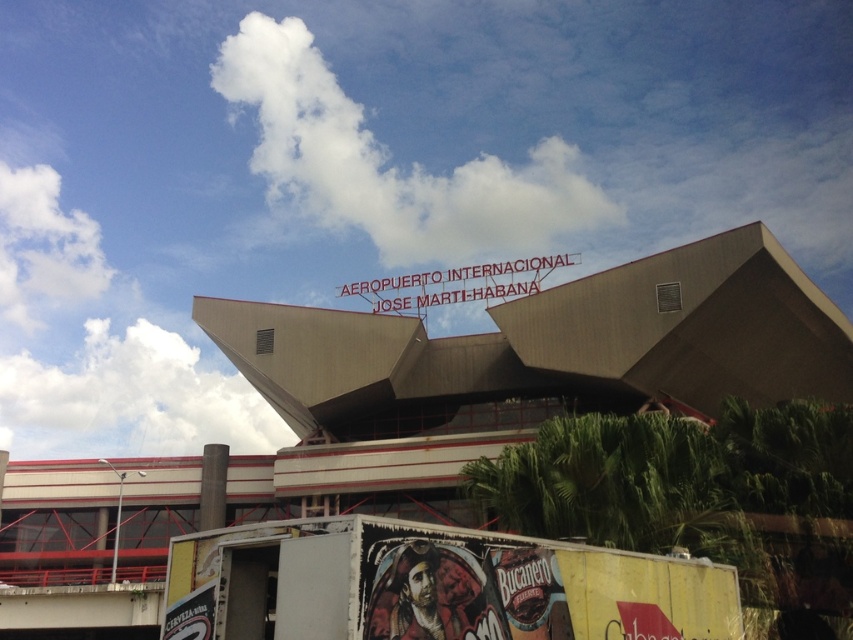
You are standing in front of the airport building and notice two points marked on the facade. Which point, point (310, 184) or point (96, 426), is closer to you?

Point (310, 184) is closer to the viewer than point (96, 426).

You are standing at the entrance of the airport and see the yellow matte trailer truck at lower center. If you were to walk directly towards the truck, which direction should you head? Please provide your answer in terms of cardinal directions like north, south, east, west, northeast, etc.

The yellow matte trailer truck at lower center is located at point (433, 586) in the image. Since the coordinate system typically places the origin at the bottom left corner, the truck is positioned towards the right side of the image. Therefore, to reach the truck, you should head east.